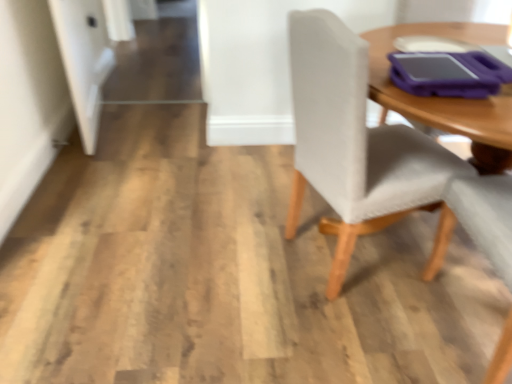
I want to click on vacant region to the left of light gray fabric chair at right, so click(x=240, y=280).